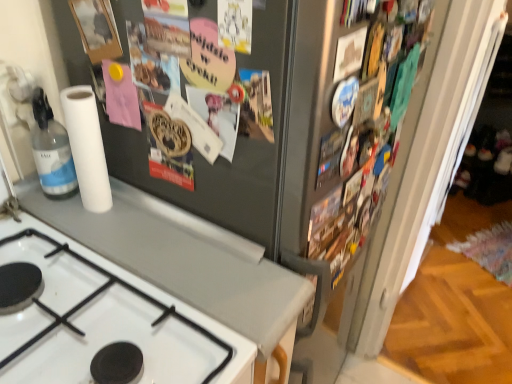
Question: From a real-world perspective, does white matte paper towel at left stand above white glossy gas stove at lower left?

Choices:
 (A) yes
 (B) no

Answer: (A)

Question: Does white matte paper towel at left have a smaller size compared to white glossy gas stove at lower left?

Choices:
 (A) no
 (B) yes

Answer: (B)

Question: Is white glossy gas stove at lower left at the back of white matte paper towel at left?

Choices:
 (A) no
 (B) yes

Answer: (A)

Question: Can you confirm if white matte paper towel at left is taller than white glossy gas stove at lower left?

Choices:
 (A) yes
 (B) no

Answer: (A)

Question: Is white matte paper towel at left at the left side of white glossy gas stove at lower left?

Choices:
 (A) yes
 (B) no

Answer: (A)

Question: Could you tell me if white matte paper towel at left is turned towards white glossy gas stove at lower left?

Choices:
 (A) yes
 (B) no

Answer: (B)

Question: Would you say white matte paper towel at left is part of white glossy gas stove at lower left's contents?

Choices:
 (A) no
 (B) yes

Answer: (A)

Question: Is white glossy gas stove at lower left outside white matte paper towel at left?

Choices:
 (A) yes
 (B) no

Answer: (A)

Question: Is white glossy gas stove at lower left positioned in front of white matte paper towel at left?

Choices:
 (A) yes
 (B) no

Answer: (A)

Question: Can you confirm if white glossy gas stove at lower left is taller than white matte paper towel at left?

Choices:
 (A) yes
 (B) no

Answer: (B)

Question: Does white glossy gas stove at lower left have a larger size compared to white matte paper towel at left?

Choices:
 (A) no
 (B) yes

Answer: (B)

Question: Considering the relative sizes of white glossy gas stove at lower left and white matte paper towel at left in the image provided, is white glossy gas stove at lower left wider than white matte paper towel at left?

Choices:
 (A) no
 (B) yes

Answer: (B)

Question: Based on their positions, is white glossy gas stove at lower left located to the left or right of white matte paper towel at left?

Choices:
 (A) right
 (B) left

Answer: (A)